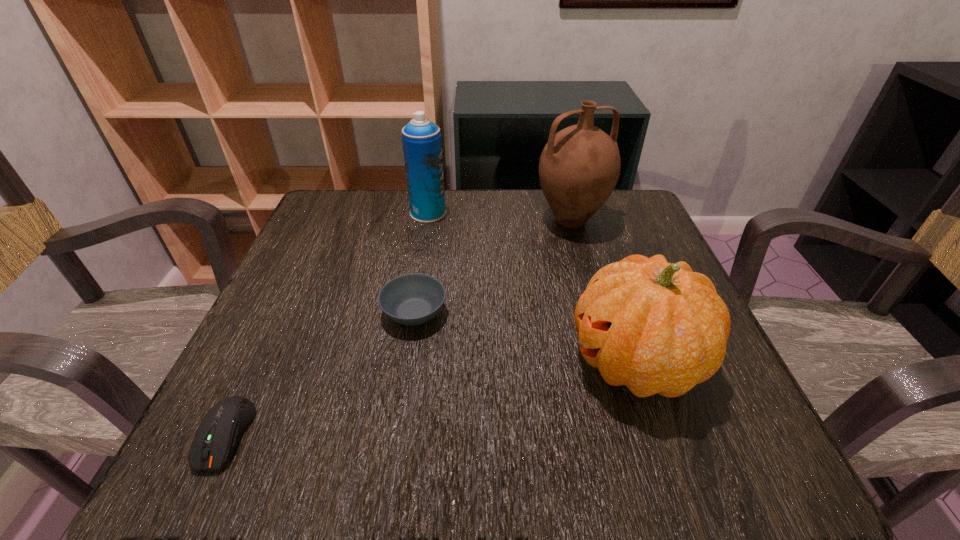
Find the location of a particular element. This screenshot has height=540, width=960. vacant space located 0.380m on the carved face of the pumpkin is located at coordinates click(x=341, y=362).

Identify the location of vacant point located 0.170m on the front of the soup bowl. This screenshot has height=540, width=960. point(396,426).

Locate an element on the screen. Image resolution: width=960 pixels, height=540 pixels. pitcher positioned at the far edge is located at coordinates click(x=579, y=167).

Where is `aerosol can that is at the far edge`? aerosol can that is at the far edge is located at coordinates pyautogui.click(x=422, y=145).

This screenshot has width=960, height=540. Identify the location of pumpkin situated at the near edge. (656, 327).

You are a GUI agent. You are given a task and a screenshot of the screen. Output one action in this format:
    pyautogui.click(x=<x>, y=<y>)
    Task: Click on the computer equipment positioned at the near edge
    The image size is (960, 540).
    Given the screenshot: What is the action you would take?
    pyautogui.click(x=222, y=427)

I want to click on object that is at the left edge, so click(x=222, y=427).

Image resolution: width=960 pixels, height=540 pixels. I want to click on pitcher located at the right edge, so click(x=579, y=167).

Identify the location of pumpkin at the right edge. (656, 327).

Where is `object situated at the near left corner`? This screenshot has height=540, width=960. object situated at the near left corner is located at coordinates (222, 427).